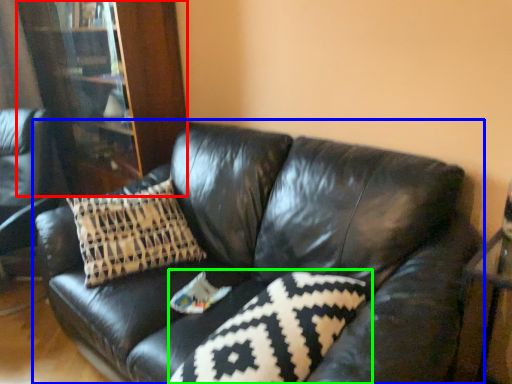
Question: Which object is the farthest from bookcase (highlighted by a red box)? Choose among these: studio couch (highlighted by a blue box) or pillow (highlighted by a green box).

Choices:
 (A) studio couch
 (B) pillow

Answer: (B)